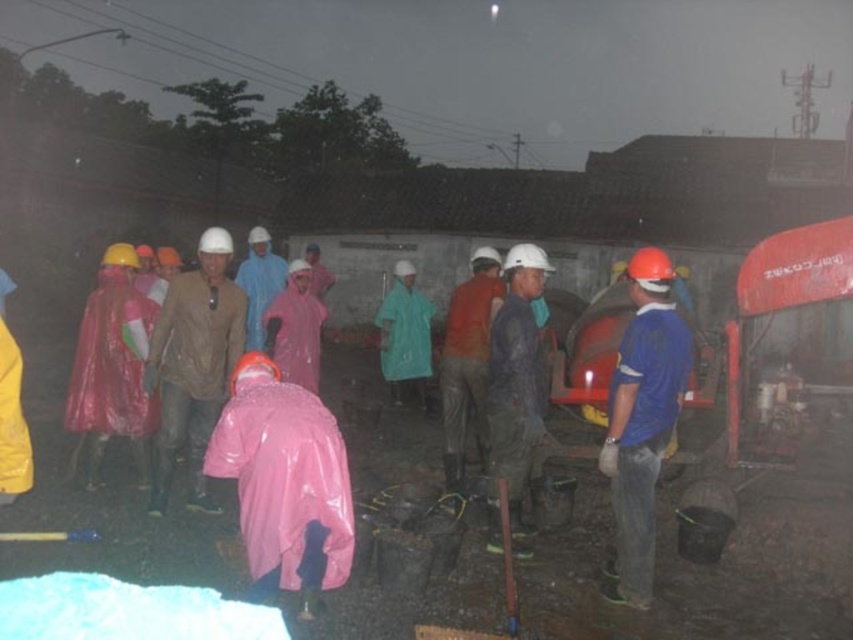
You are standing at the origin point in the image. Where is the matte brown jacket at center located in terms of coordinates?

The matte brown jacket at center is located at coordinates point (x=193, y=364).

You are a safety inspector checking the equipment placement of the workers in the scene. According to the image, where is the matte brown jacket at center in relation to the wet fabric helmet at center?

The matte brown jacket at center is to the left of the wet fabric helmet at center.